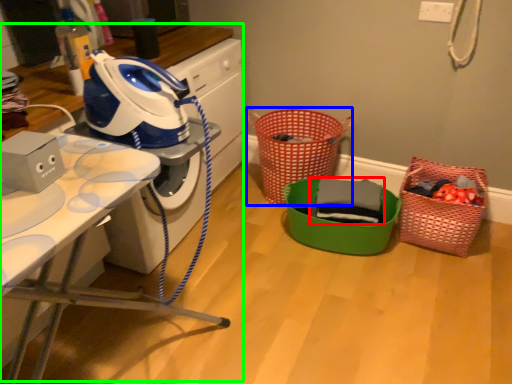
Question: Considering the real-world distances, which object is closest to clothing (highlighted by a red box)? basket (highlighted by a blue box) or computer desk (highlighted by a green box).

Choices:
 (A) basket
 (B) computer desk

Answer: (A)